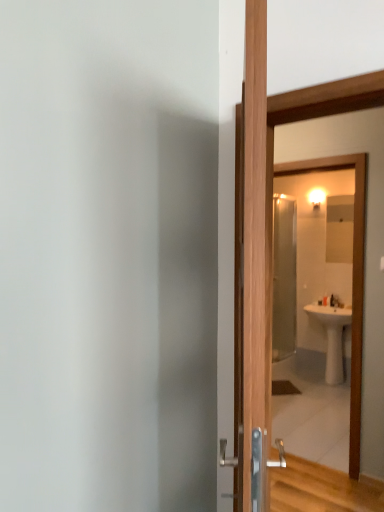
The image size is (384, 512). Find the location of `wooden door at center`. wooden door at center is located at coordinates (365, 248).

What do you see at coordinates (365, 248) in the screenshot? Image resolution: width=384 pixels, height=512 pixels. I see `wooden door at center` at bounding box center [365, 248].

Where is `wooden door at center`? This screenshot has width=384, height=512. wooden door at center is located at coordinates (365, 248).